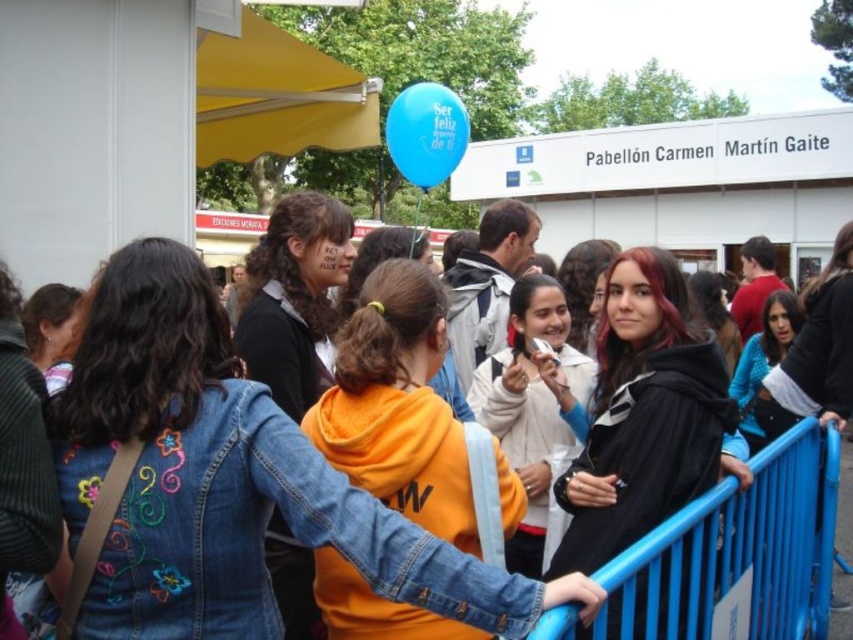
What is the size relationship between the orange fleece at center and the blue denim jacket at lower right?

The orange fleece at center is smaller than the blue denim jacket at lower right.